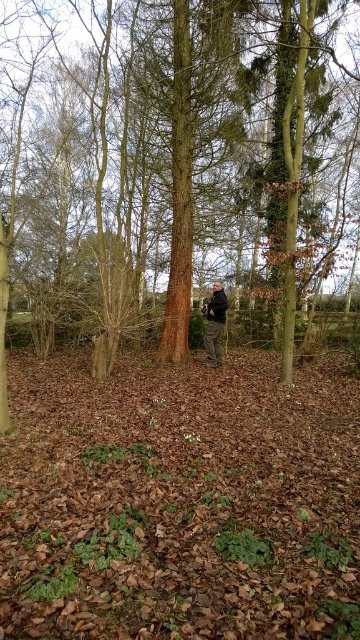
Question: Where is brown wood tree at center located in relation to dark gray jacket at center in the image?

Choices:
 (A) below
 (B) above

Answer: (B)

Question: Which of the following is the farthest from the observer?

Choices:
 (A) (216, 337)
 (B) (124, 163)

Answer: (B)

Question: Is brown wood tree at center further to the viewer compared to dark gray jacket at center?

Choices:
 (A) yes
 (B) no

Answer: (B)

Question: Which point appears farthest from the camera in this image?

Choices:
 (A) (290, 326)
 (B) (206, 340)

Answer: (B)

Question: Where is brown wood tree at center located in relation to dark gray jacket at center in the image?

Choices:
 (A) right
 (B) left

Answer: (B)

Question: Which point is farther from the camera taking this photo?

Choices:
 (A) (33, 202)
 (B) (204, 336)

Answer: (A)